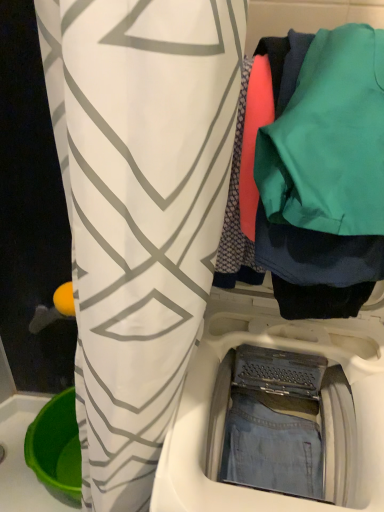
You are a GUI agent. You are given a task and a screenshot of the screen. Output one action in this format:
    pyautogui.click(x=<x>, y=<y>)
    Task: Click on the teal fabric at upper right
    This screenshot has height=512, width=384.
    Given the screenshot: What is the action you would take?
    pyautogui.click(x=291, y=225)

This screenshot has width=384, height=512. What do you see at coordinates (291, 225) in the screenshot? I see `teal fabric at upper right` at bounding box center [291, 225].

What do you see at coordinates (228, 391) in the screenshot? The height and width of the screenshot is (512, 384). I see `denim fabric washing machine at center` at bounding box center [228, 391].

Where is `denim fabric washing machine at center`? The image size is (384, 512). denim fabric washing machine at center is located at coordinates (228, 391).

The width and height of the screenshot is (384, 512). I want to click on teal fabric at upper right, so click(x=291, y=225).

Is denim fabric washing machine at center at the right side of teal fabric at upper right?

No.

Considering the positions of objects denim fabric washing machine at center and teal fabric at upper right in the image provided, who is behind, denim fabric washing machine at center or teal fabric at upper right?

denim fabric washing machine at center is further away from the camera.

Is point (339, 490) farther from camera compared to point (279, 240)?

Yes, point (339, 490) is farther from viewer.

From the image's perspective, which is below, denim fabric washing machine at center or teal fabric at upper right?

denim fabric washing machine at center is shown below in the image.

From a real-world perspective, is denim fabric washing machine at center above or below teal fabric at upper right?

From a real-world perspective, denim fabric washing machine at center is physically below teal fabric at upper right.

Considering the sizes of objects denim fabric washing machine at center and teal fabric at upper right in the image provided, who is wider, denim fabric washing machine at center or teal fabric at upper right?

Wider between the two is denim fabric washing machine at center.

Considering the sizes of objects denim fabric washing machine at center and teal fabric at upper right in the image provided, who is taller, denim fabric washing machine at center or teal fabric at upper right?

denim fabric washing machine at center is taller.

Who is smaller, denim fabric washing machine at center or teal fabric at upper right?

teal fabric at upper right is smaller.

Is denim fabric washing machine at center positioned beyond the bounds of teal fabric at upper right?

Yes, denim fabric washing machine at center is outside of teal fabric at upper right.

Are denim fabric washing machine at center and teal fabric at upper right beside each other?

denim fabric washing machine at center and teal fabric at upper right are clearly separated.

Does denim fabric washing machine at center turn towards teal fabric at upper right?

No, denim fabric washing machine at center is not facing towards teal fabric at upper right.

You are a GUI agent. You are given a task and a screenshot of the screen. Output one action in this format:
    pyautogui.click(x=<x>, y=<y>)
    Task: Click on the closet above the denim fabric washing machine at center (from a real-world perspective)
    
    Given the screenshot: What is the action you would take?
    pyautogui.click(x=291, y=225)

Is teal fabric at upper right to the right of denim fabric washing machine at center from the viewer's perspective?

Yes, teal fabric at upper right is to the right of denim fabric washing machine at center.

Considering the positions of objects teal fabric at upper right and denim fabric washing machine at center in the image provided, who is behind, teal fabric at upper right or denim fabric washing machine at center?

denim fabric washing machine at center.

Which is behind, point (292, 52) or point (235, 488)?

The point (235, 488) is farther.

From the image's perspective, is teal fabric at upper right under denim fabric washing machine at center?

No.

From a real-world perspective, between teal fabric at upper right and denim fabric washing machine at center, who is vertically lower?

denim fabric washing machine at center is physically lower.

Can you confirm if teal fabric at upper right is thinner than denim fabric washing machine at center?

Yes.

Considering the sizes of teal fabric at upper right and denim fabric washing machine at center in the image, is teal fabric at upper right taller or shorter than denim fabric washing machine at center?

In the image, teal fabric at upper right appears to be shorter than denim fabric washing machine at center.

Does teal fabric at upper right have a larger size compared to denim fabric washing machine at center?

No, teal fabric at upper right is not bigger than denim fabric washing machine at center.

Is teal fabric at upper right positioned beyond the bounds of denim fabric washing machine at center?

Indeed, teal fabric at upper right is completely outside denim fabric washing machine at center.

Is teal fabric at upper right far from denim fabric washing machine at center?

teal fabric at upper right is actually quite close to denim fabric washing machine at center.

From the picture: Is teal fabric at upper right turned away from denim fabric washing machine at center?

No, teal fabric at upper right is not facing away from denim fabric washing machine at center.

What's the angular difference between teal fabric at upper right and denim fabric washing machine at center's facing directions?

teal fabric at upper right and denim fabric washing machine at center are facing 0.00122 degrees away from each other.

The width and height of the screenshot is (384, 512). In order to click on washing machine below the teal fabric at upper right (from the image's perspective) in this screenshot , I will do coord(228,391).

This screenshot has height=512, width=384. I want to click on closet on the right of denim fabric washing machine at center, so click(291, 225).

At what (x,y) coordinates should I click in order to perform the action: click on washing machine that is under the teal fabric at upper right (from a real-world perspective). Please return your answer as a coordinate pair (x, y). Looking at the image, I should click on (228, 391).